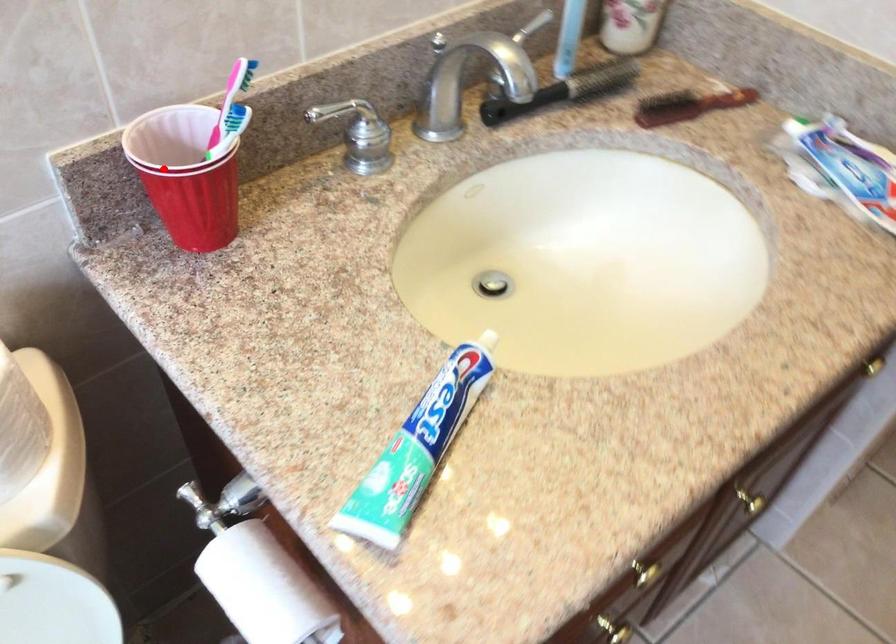
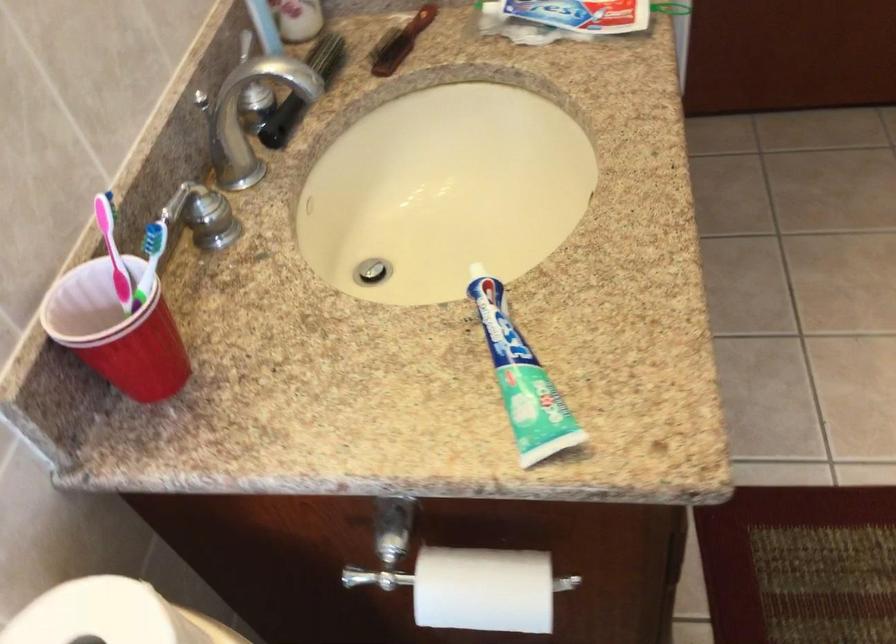
In the second image, find the point that corresponds to the highlighted location in the first image.

(116, 330)